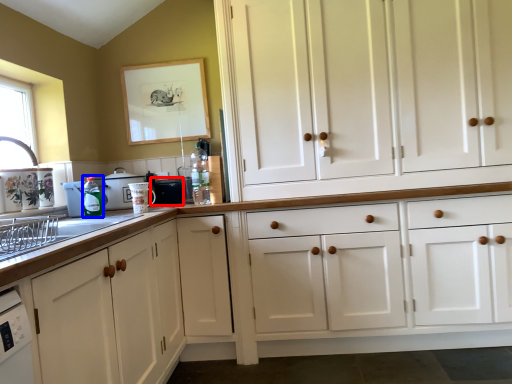
Question: Among these objects, which one is farthest to the camera, appliance (highlighted by a red box) or bottle (highlighted by a blue box)?

Choices:
 (A) appliance
 (B) bottle

Answer: (A)